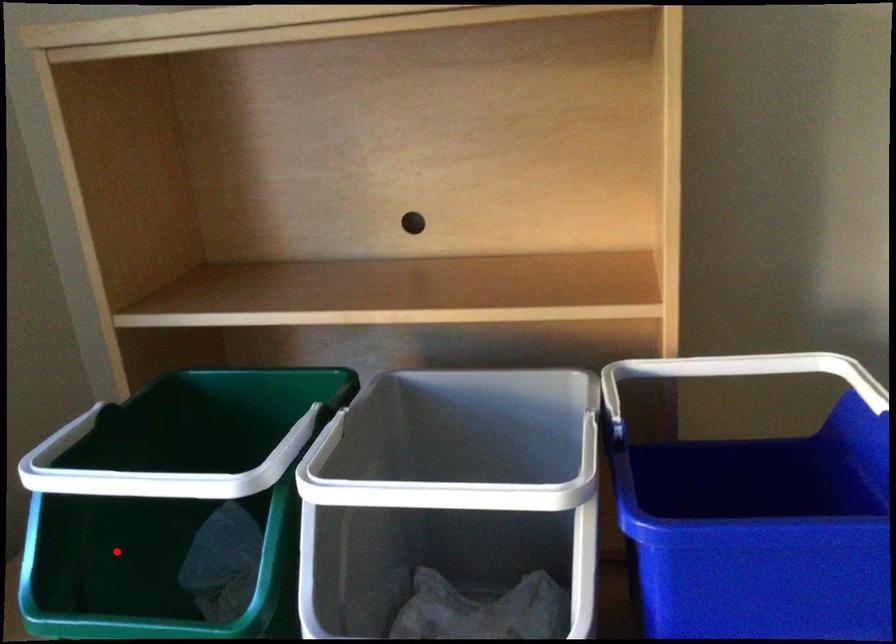
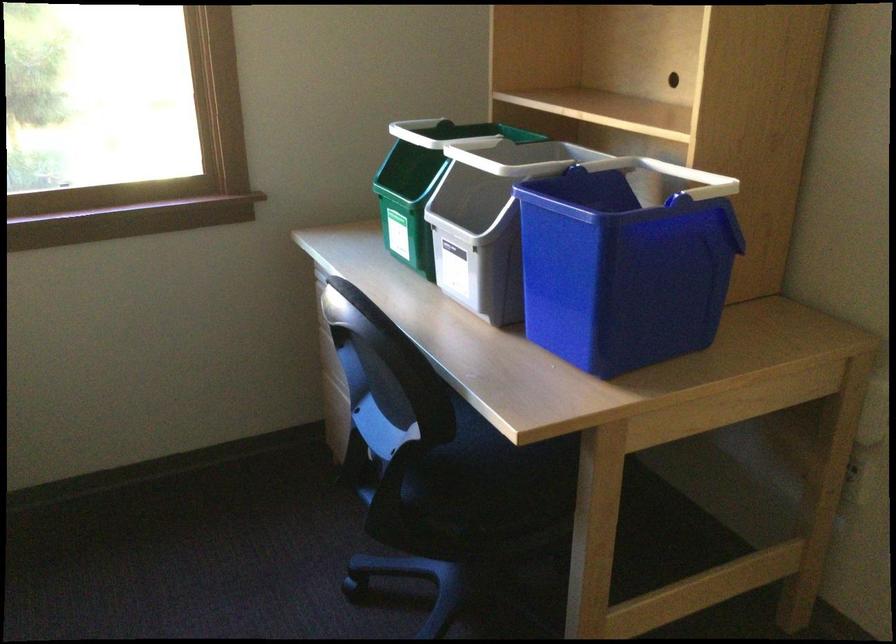
The point at the highlighted location is marked in the first image. Where is the corresponding point in the second image?

(421, 184)